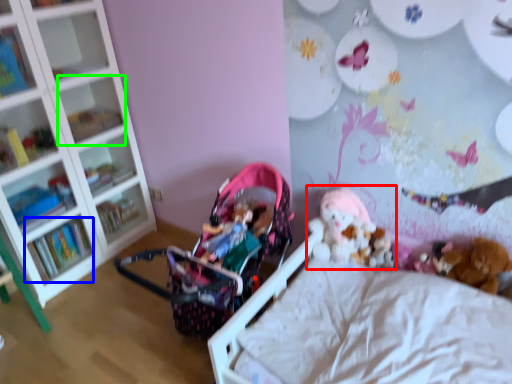
Question: Which object is the farthest from toy (highlighted by a red box)? Choose among these: book (highlighted by a blue box) or shelf (highlighted by a green box).

Choices:
 (A) book
 (B) shelf

Answer: (A)